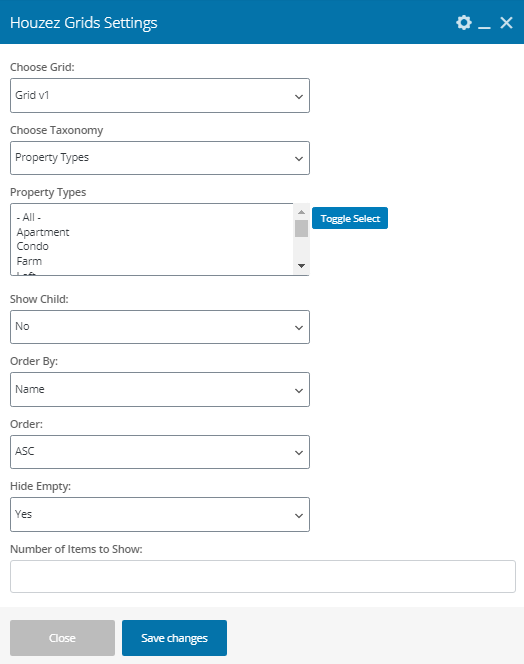
At what (x,y) coordinates should I click in order to perform the action: click on exit button. Please return your answer as a coordinate pair (x, y). Looking at the image, I should click on (507, 23).